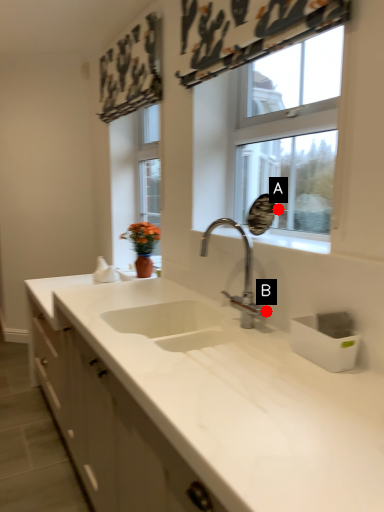
Question: Two points are circled on the image, labeled by A and B beside each circle. Which of the following is the farthest from the observer?

Choices:
 (A) A is further
 (B) B is further

Answer: (A)